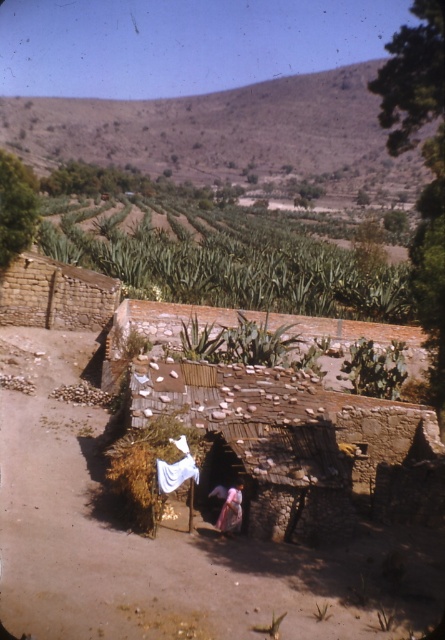
Question: Among these points, which one is farthest from the camera?

Choices:
 (A) (383, 429)
 (B) (17, 557)

Answer: (A)

Question: Does brown dirt track at center come in front of rustic stone hut at center?

Choices:
 (A) yes
 (B) no

Answer: (A)

Question: Where is brown dirt track at center located in relation to rustic stone hut at center in the image?

Choices:
 (A) below
 (B) above

Answer: (A)

Question: Is brown dirt track at center closer to the viewer compared to rustic stone hut at center?

Choices:
 (A) yes
 (B) no

Answer: (A)

Question: Which of the following is the closest to the observer?

Choices:
 (A) brown dirt track at center
 (B) rustic stone hut at center

Answer: (A)